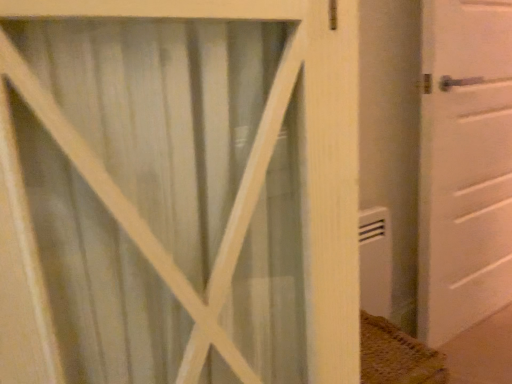
The image size is (512, 384). What do you see at coordinates (464, 165) in the screenshot? I see `white matte door at right` at bounding box center [464, 165].

You are a GUI agent. You are given a task and a screenshot of the screen. Output one action in this format:
    pyautogui.click(x=<x>, y=<y>)
    Task: Click on the white matte door at right
    This screenshot has height=384, width=512.
    Given the screenshot: What is the action you would take?
    pyautogui.click(x=464, y=165)

I want to click on white matte door at right, so click(464, 165).